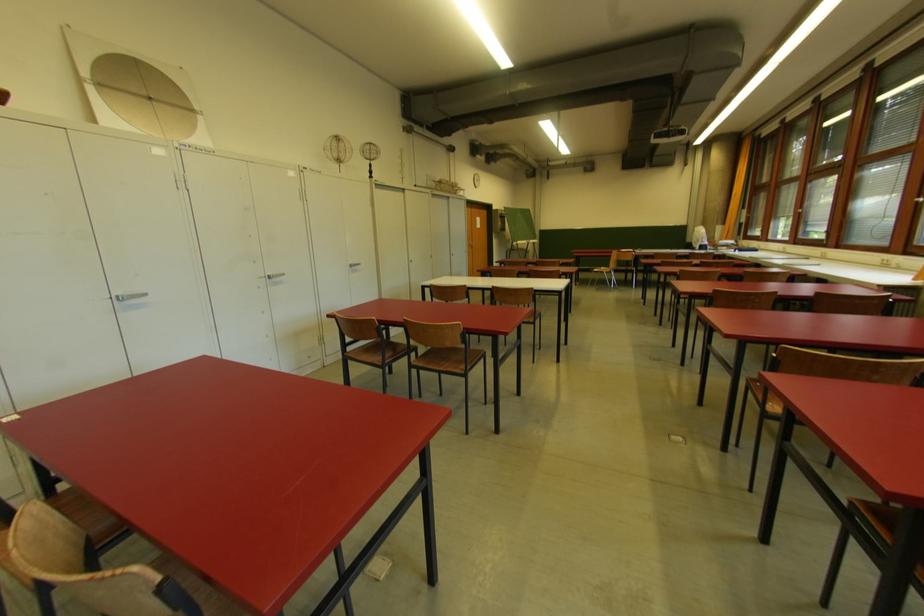
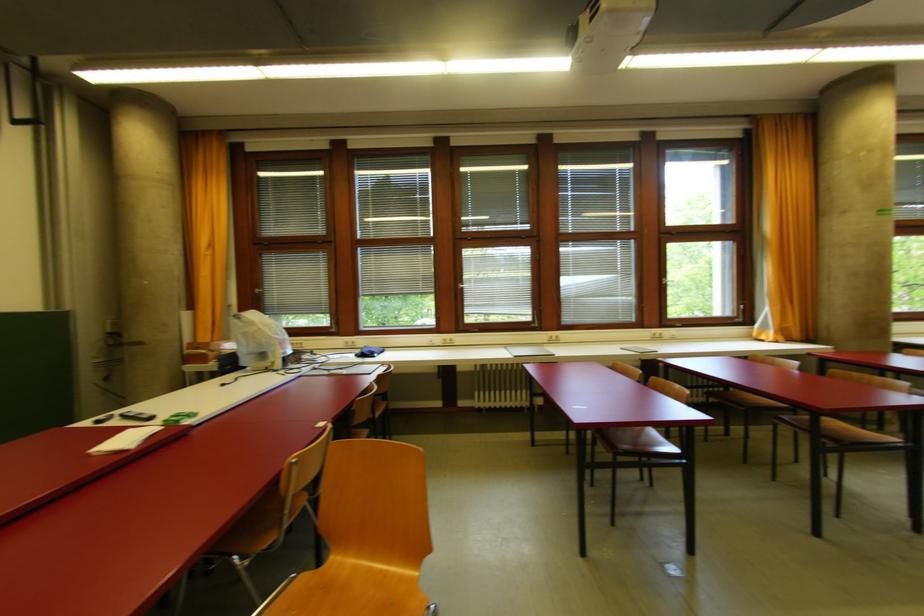
The point at (889,264) is marked in the first image. Where is the corresponding point in the second image?

(660, 338)